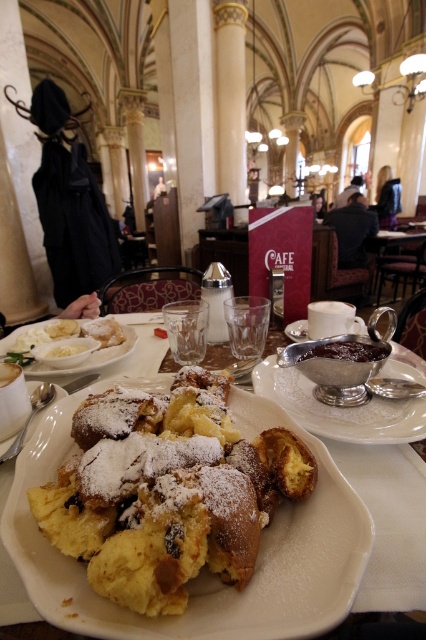
Between powdered sugar pastry at lower left and dark chocolate spread at center, which one is positioned lower?

powdered sugar pastry at lower left

Can you confirm if powdered sugar pastry at lower left is taller than dark chocolate spread at center?

Yes, powdered sugar pastry at lower left is taller than dark chocolate spread at center.

Is point (109, 355) more distant than point (350, 344)?

Yes, point (109, 355) is farther from viewer.

Identify the location of powdered sugar pastry at lower left. pyautogui.click(x=89, y=358).

Who is more distant from viewer, (373,412) or (299,332)?

Point (299,332)

Measure the distance from silver metallic bowl at center to silver metallic saucer at center.

A distance of 7.37 inches exists between silver metallic bowl at center and silver metallic saucer at center.

Which is behind, point (422, 406) or point (301, 337)?

The point (301, 337) is more distant.

Where is `silver metallic bowl at center`? The image size is (426, 640). silver metallic bowl at center is located at coordinates (339, 410).

Does powdered sugar pastry at lower left appear under silver metallic saucer at center?

Correct, powdered sugar pastry at lower left is located below silver metallic saucer at center.

Who is taller, powdered sugar pastry at lower left or silver metallic saucer at center?

With more height is powdered sugar pastry at lower left.

The image size is (426, 640). Find the location of `powdered sugar pastry at lower left`. powdered sugar pastry at lower left is located at coordinates (89, 358).

Locate an element on the screen. Image resolution: width=426 pixels, height=640 pixels. powdered sugar pastry at lower left is located at coordinates (89, 358).